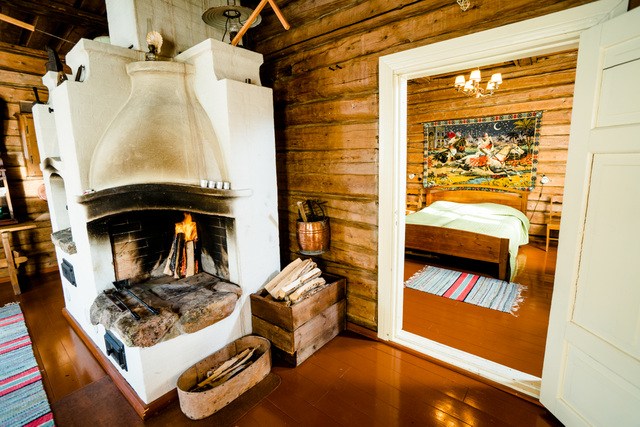
Find the location of a particular element. This screenshot has height=427, width=640. footboard is located at coordinates point(457,253).